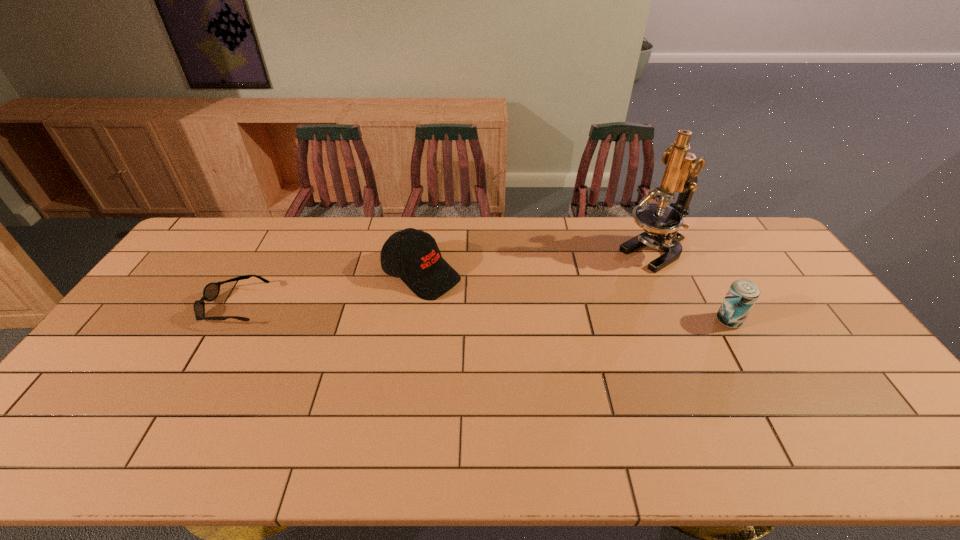
Where is `free space on the desktop that is between the sunglasses and the beer can and is positioned on the front-facing side of the baseball cap`? The image size is (960, 540). free space on the desktop that is between the sunglasses and the beer can and is positioned on the front-facing side of the baseball cap is located at coordinates (492, 314).

Identify the location of vacant space on the desktop that is between the sunglasses and the beer can and is positioned at the eyepiece of the tallest object. The height and width of the screenshot is (540, 960). [x=548, y=316].